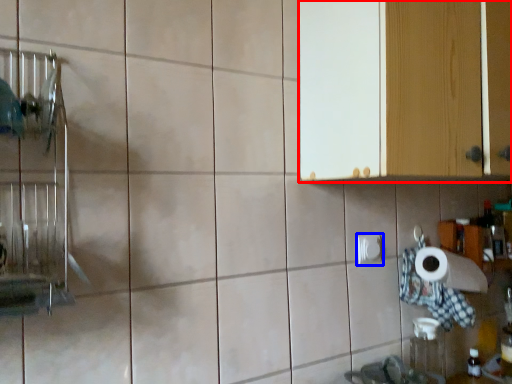
Question: Which object appears farthest to the camera in this image, cabinetry (highlighted by a red box) or toilet paper (highlighted by a blue box)?

Choices:
 (A) cabinetry
 (B) toilet paper

Answer: (B)